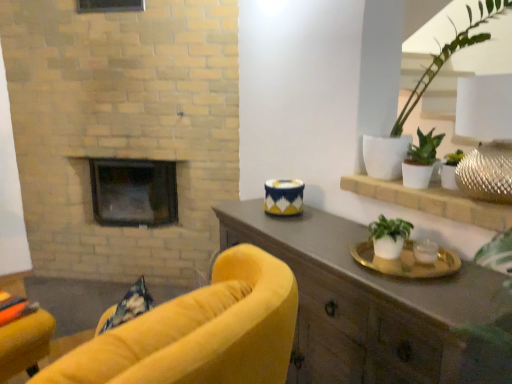
The height and width of the screenshot is (384, 512). Find the location of `free space to the left of blue and white ceramic candle holder at center`. free space to the left of blue and white ceramic candle holder at center is located at coordinates (245, 215).